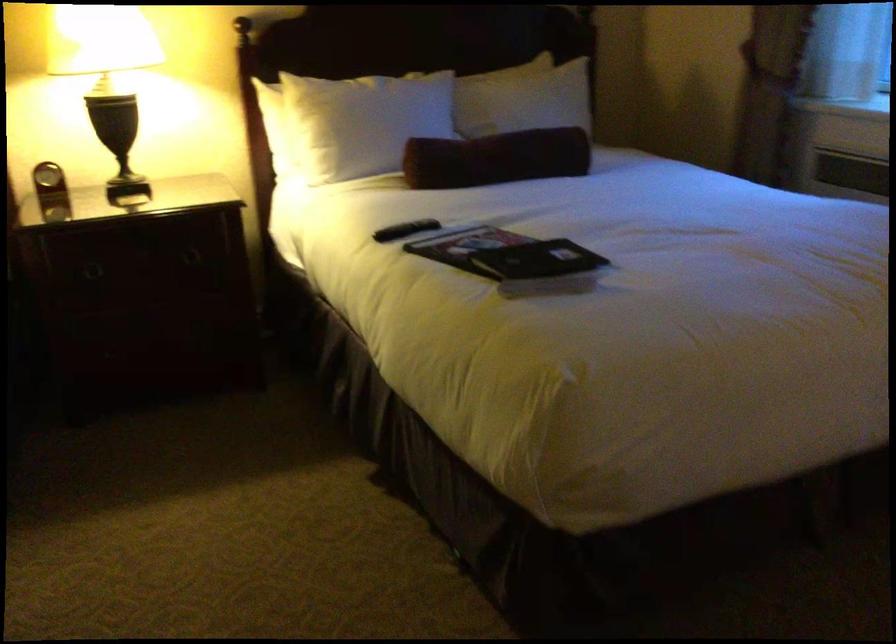
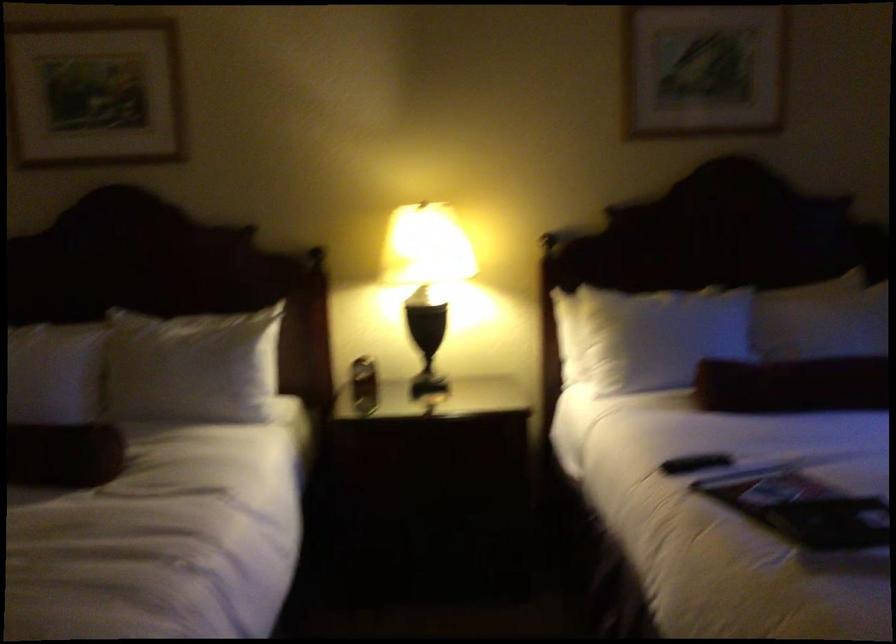
Locate, in the second image, the point that corresponds to point (358, 124) in the first image.

(652, 337)